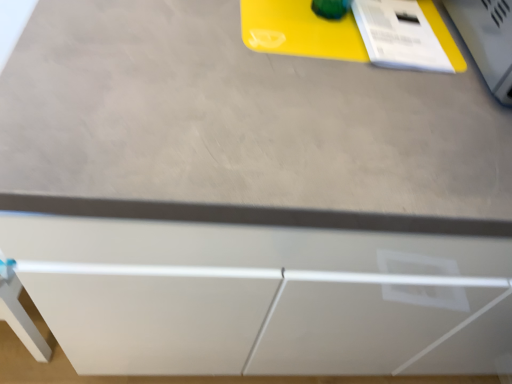
Based on the photo, measure the distance between matte gray countertop at center and camera.

matte gray countertop at center is 17.48 inches away from camera.

The width and height of the screenshot is (512, 384). What are the coordinates of `matte gray countertop at center` in the screenshot? It's located at (240, 128).

Measure the distance between point (x=202, y=184) and camera.

The depth of point (x=202, y=184) is 19.09 inches.

Describe the element at coordinates (240, 128) in the screenshot. I see `matte gray countertop at center` at that location.

This screenshot has width=512, height=384. Find the location of `matte gray countertop at center`. matte gray countertop at center is located at coordinates (240, 128).